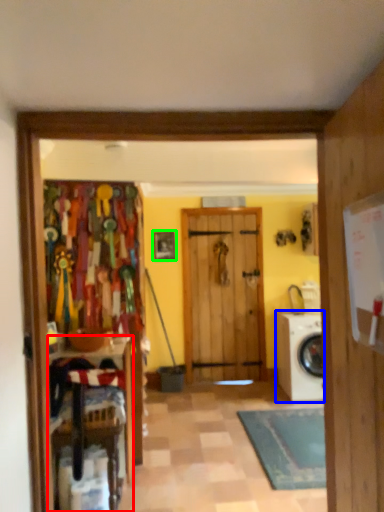
Question: Which object is positioned farthest from furniture (highlighted by a red box)? Select from washing machine (highlighted by a blue box) and picture frame (highlighted by a green box).

Choices:
 (A) washing machine
 (B) picture frame

Answer: (B)